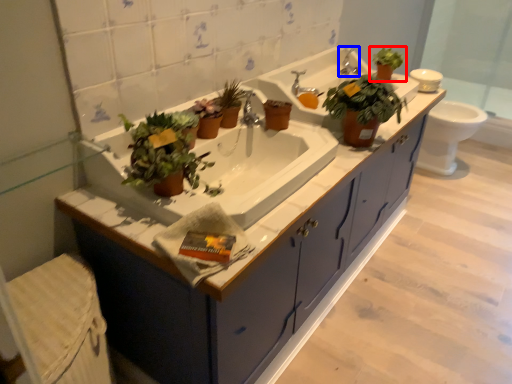
Question: Among these objects, which one is nearest to the camera, houseplant (highlighted by a red box) or faucet (highlighted by a blue box)?

Choices:
 (A) houseplant
 (B) faucet

Answer: (A)